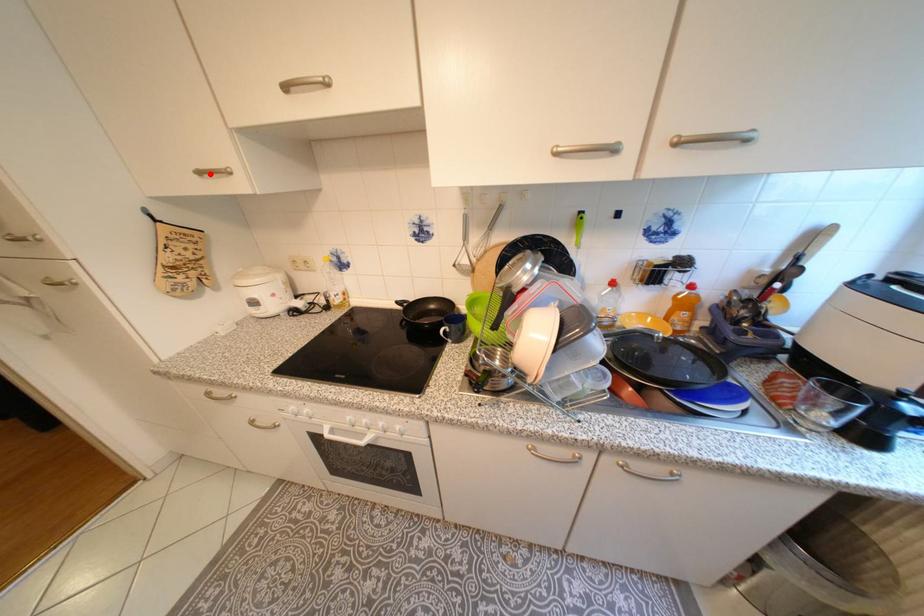
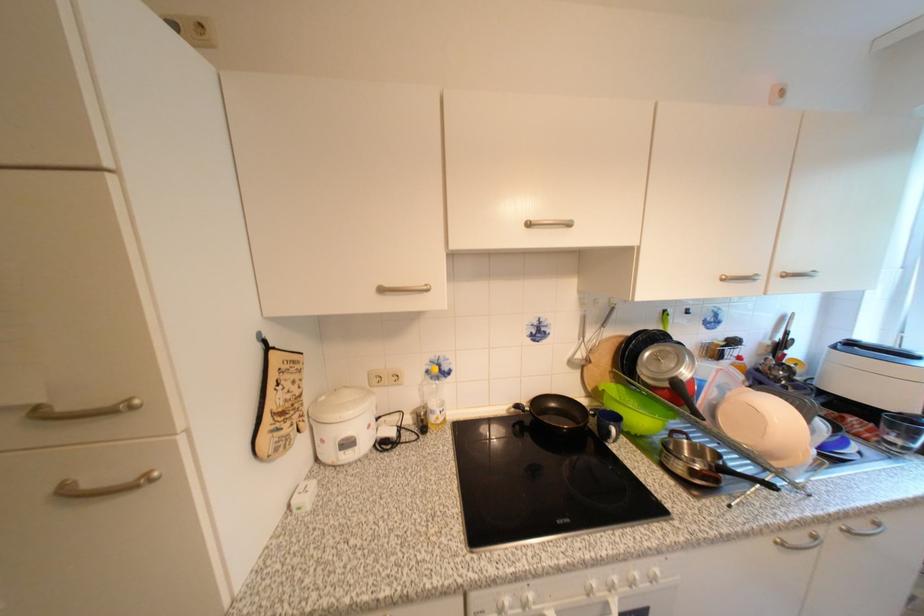
Find the pixel in the second image that matches the highlighted location in the first image.

(391, 291)